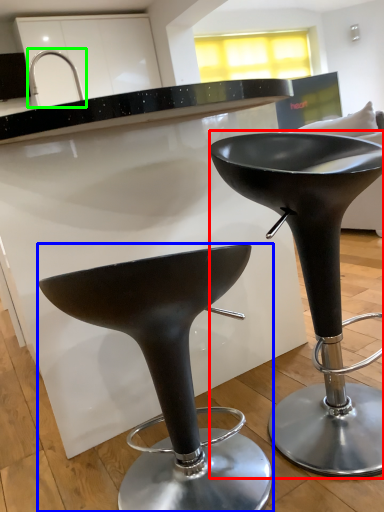
Question: Considering the real-world distances, which object is farthest from stool (highlighted by a red box)? stool (highlighted by a blue box) or faucet (highlighted by a green box)?

Choices:
 (A) stool
 (B) faucet

Answer: (B)